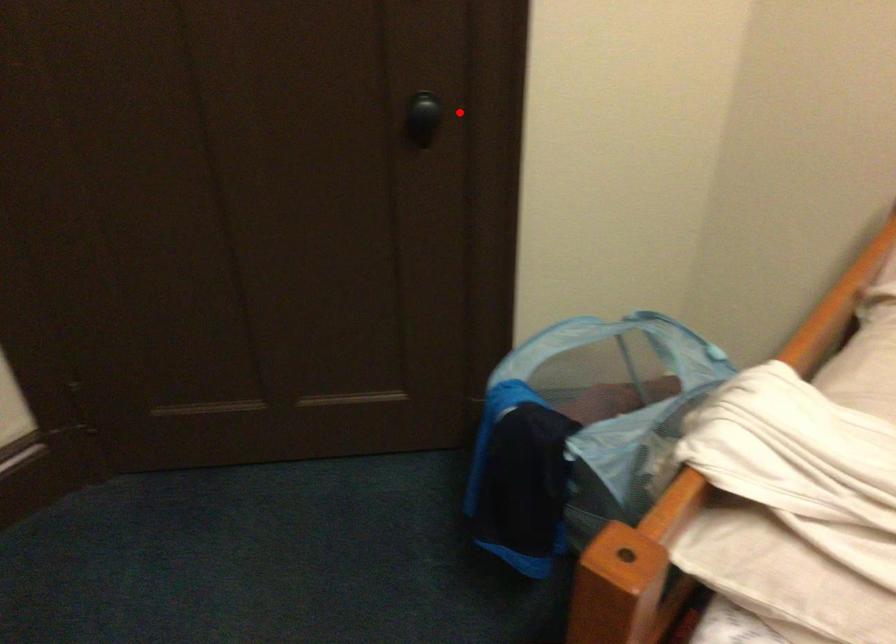
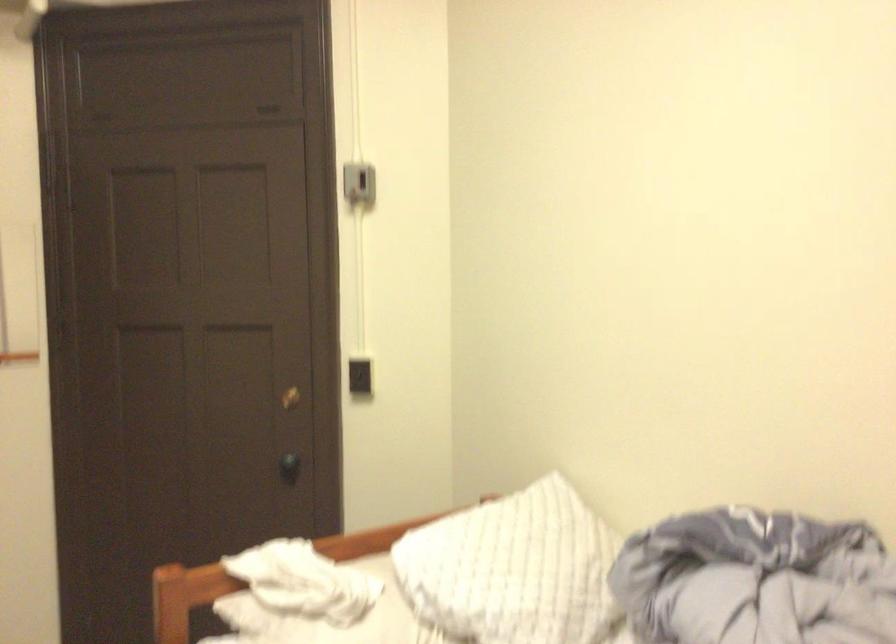
In the second image, find the point that corresponds to the highlighted location in the first image.

(289, 467)